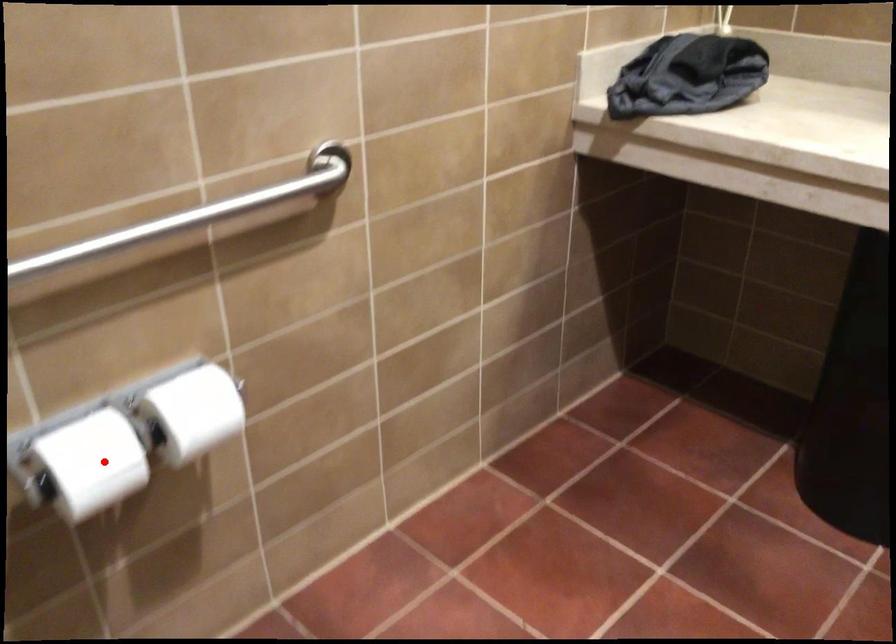
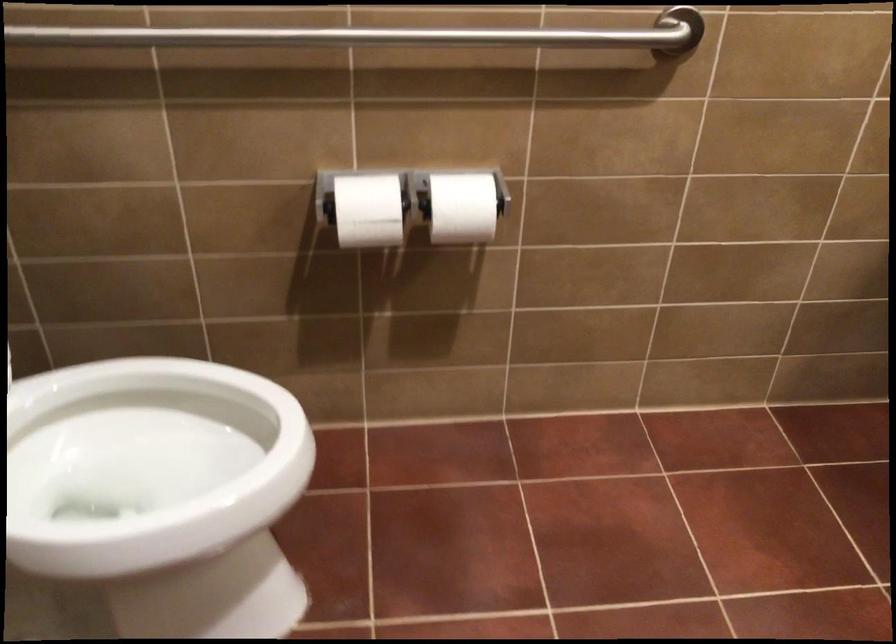
In the second image, find the point that corresponds to the highlighted location in the first image.

(367, 210)